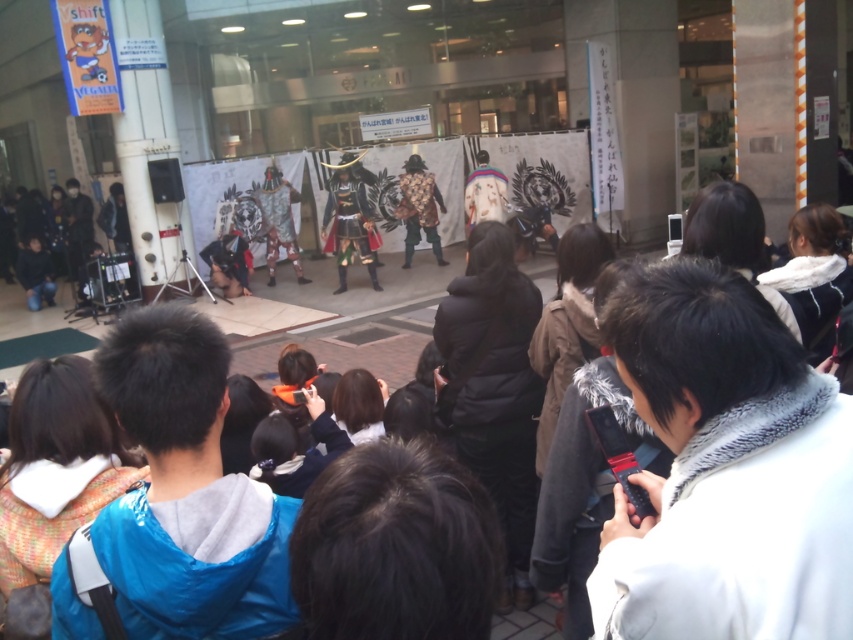
Is the position of white fur-trimmed coat at center more distant than that of shiny metallic armor at center?

No.

Between white fur-trimmed coat at center and shiny metallic armor at center, which one appears on the left side from the viewer's perspective?

shiny metallic armor at center is more to the left.

Is point (715, 460) less distant than point (363, 260)?

Yes.

Image resolution: width=853 pixels, height=640 pixels. Identify the location of white fur-trimmed coat at center. (724, 468).

At what (x,y) coordinates should I click in order to perform the action: click on white fur-trimmed coat at center. Please return your answer as a coordinate pair (x, y). Looking at the image, I should click on (724, 468).

Does white fur-trimmed coat at center appear over leather armor at center?

No, white fur-trimmed coat at center is not above leather armor at center.

Does point (672, 262) come farther from viewer compared to point (407, 234)?

No, (672, 262) is in front of (407, 234).

You are a GUI agent. You are given a task and a screenshot of the screen. Output one action in this format:
    pyautogui.click(x=<x>, y=<y>)
    Task: Click on the white fur-trimmed coat at center
    The image size is (853, 640).
    Given the screenshot: What is the action you would take?
    pyautogui.click(x=724, y=468)

Can you confirm if shiny metallic armor at center is bigger than leather armor at center?

Indeed, shiny metallic armor at center has a larger size compared to leather armor at center.

I want to click on shiny metallic armor at center, so click(349, 221).

Image resolution: width=853 pixels, height=640 pixels. I want to click on shiny metallic armor at center, so click(349, 221).